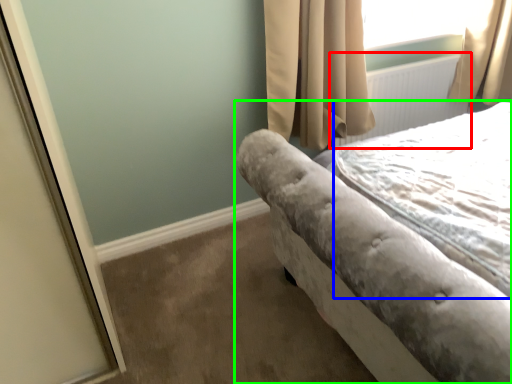
Question: Considering the real-world distances, which object is closest to radiator (highlighted by a red box)? sheet (highlighted by a blue box) or bed (highlighted by a green box).

Choices:
 (A) sheet
 (B) bed

Answer: (A)